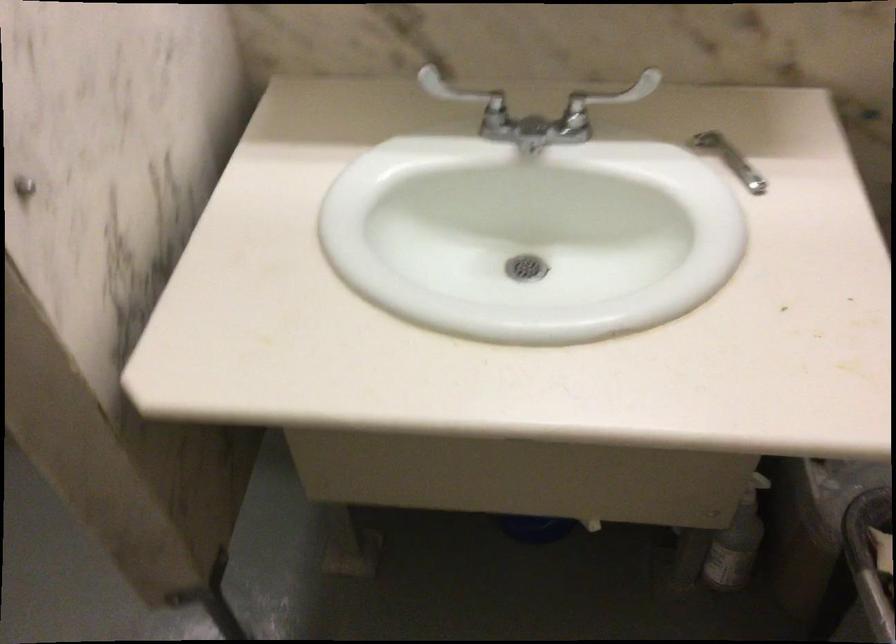
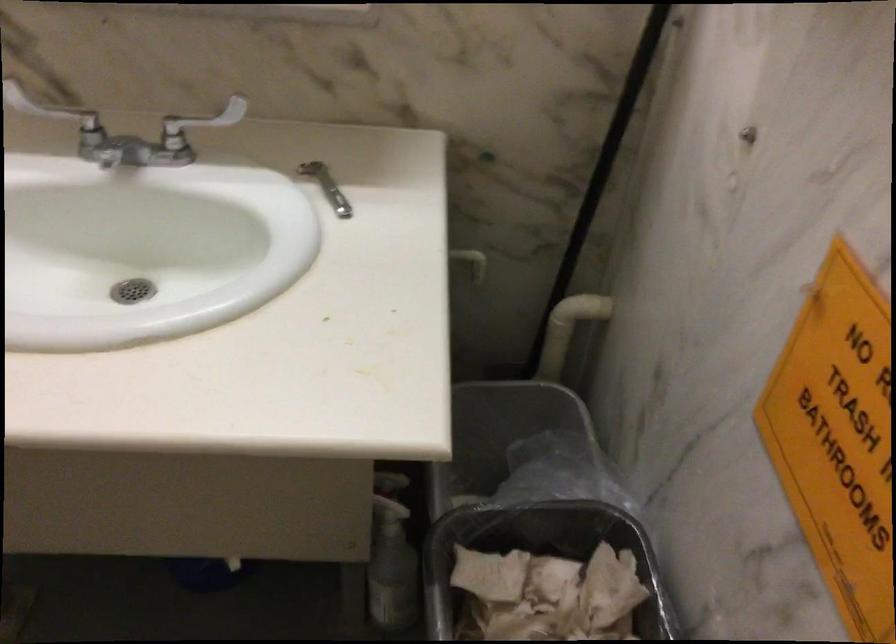
Question: The images are taken continuously from a first-person perspective. In which direction are you moving?

Choices:
 (A) Left
 (B) Right
 (C) Forward
 (D) Backward

Answer: (B)